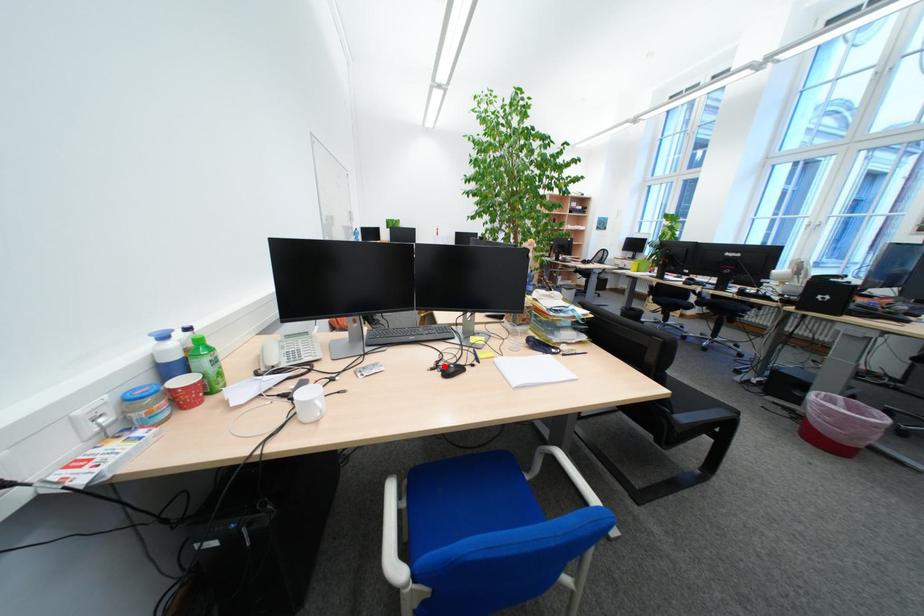
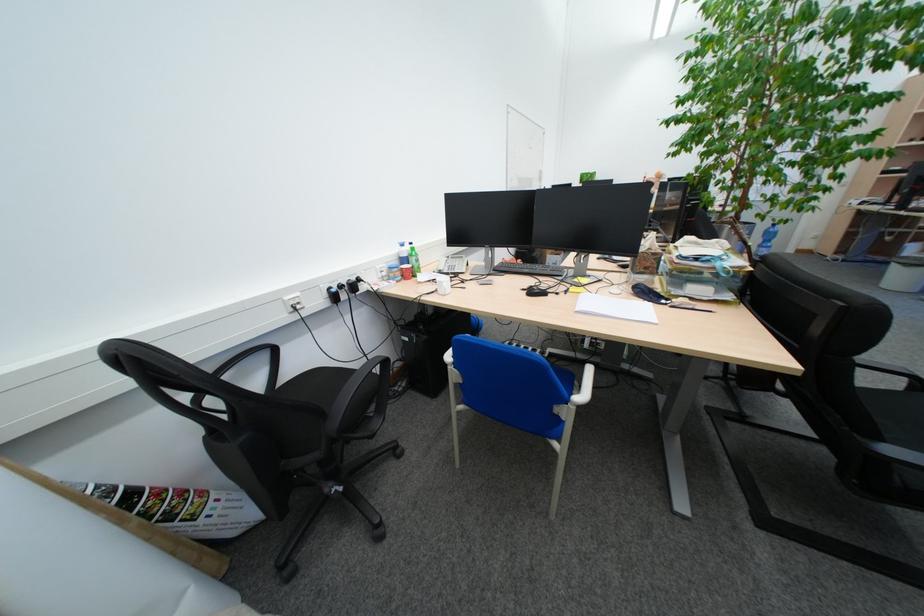
Where in the second image is the point corresponding to the highlighted location from the first image?

(537, 288)